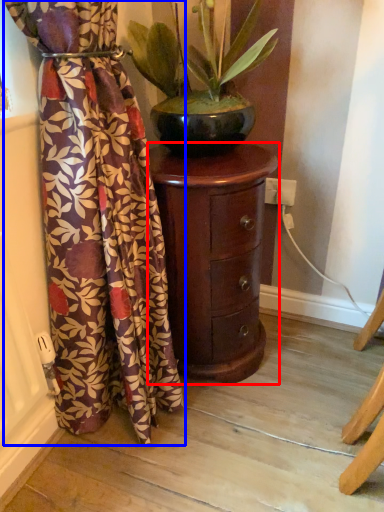
Question: Which object appears farthest to the camera in this image, furniture (highlighted by a red box) or curtain (highlighted by a blue box)?

Choices:
 (A) furniture
 (B) curtain

Answer: (A)